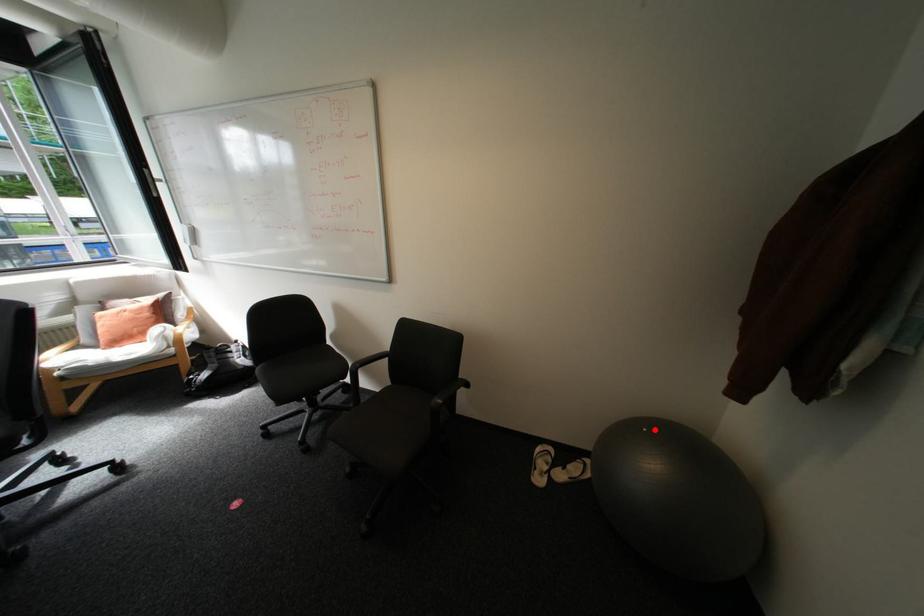
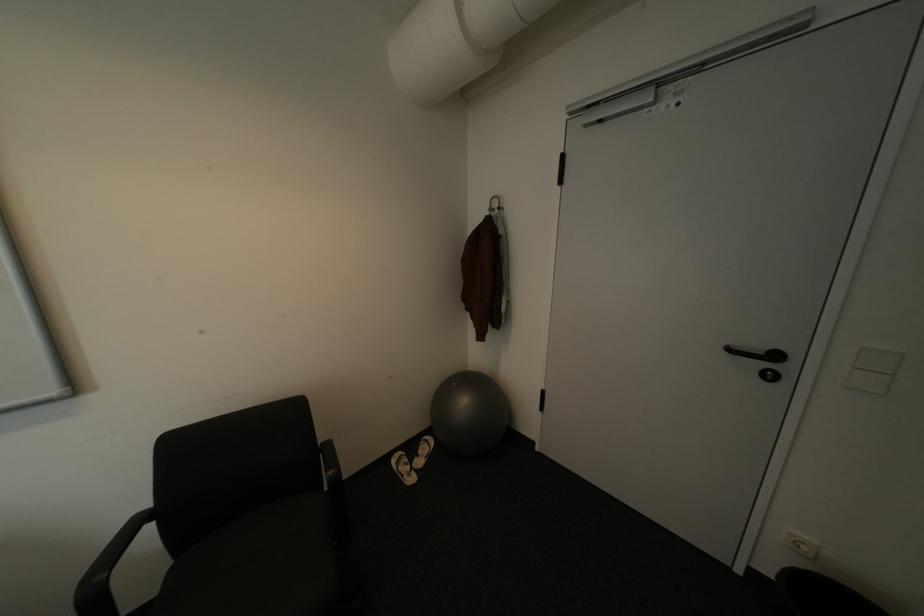
The point at the highlighted location is marked in the first image. Where is the corresponding point in the second image?

(464, 384)